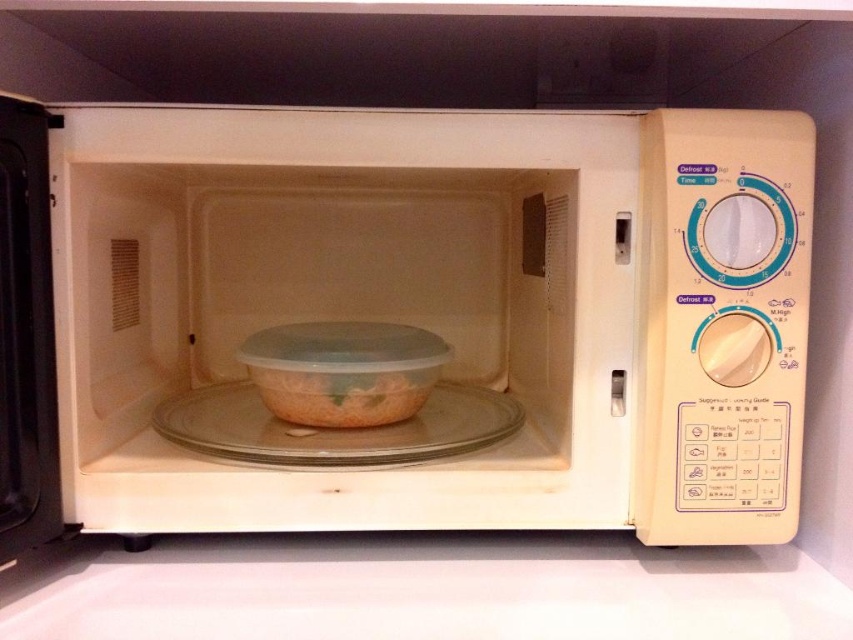
You are preparing to place a small bowl on the clear glass plate at center, which is on top of the white matte counter top at lower center. Will the bowl fit entirely on the plate without hanging over the edges?

The white matte counter top at lower center is shorter than the clear glass plate at center, meaning the plate is taller. However, the question is about the bowl fitting on the plate. Since the counter top is shorter than the plate, it implies the plate has a larger height, but this doesn not necessarily indicate the plate is wider. Without information about the plate width, we cannot determine if the bowl will fit. Please check the plate width.

You are standing in front of the microwave oven and want to reach the point at coordinates point (194, 404). If your hand can extend 28 inches, can you comfortably reach it?

The point (194, 404) is 31.72 inches away from your current position. Since your hand can only extend 28 inches, you cannot comfortably reach it.

You are standing in front of the microwave oven with its door open. You need to reach a point that is 19.94 inches away from you. Can you determine if the point at coordinates point (x=561, y=625) is within your reach?

The point at coordinates point (x=561, y=625) is 19.94 inches away from the viewer, so yes, it is within reach since the distance matches the required 19.94 inches.